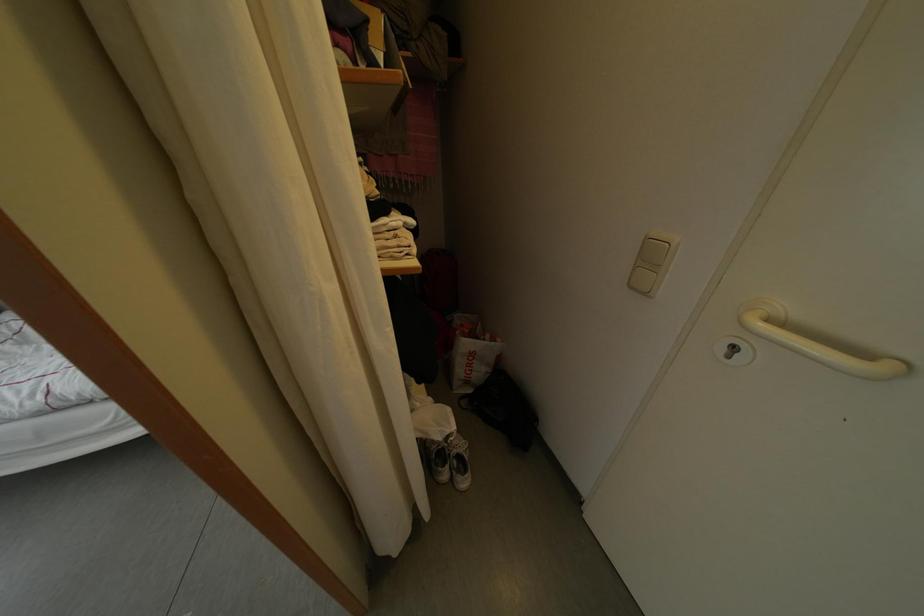
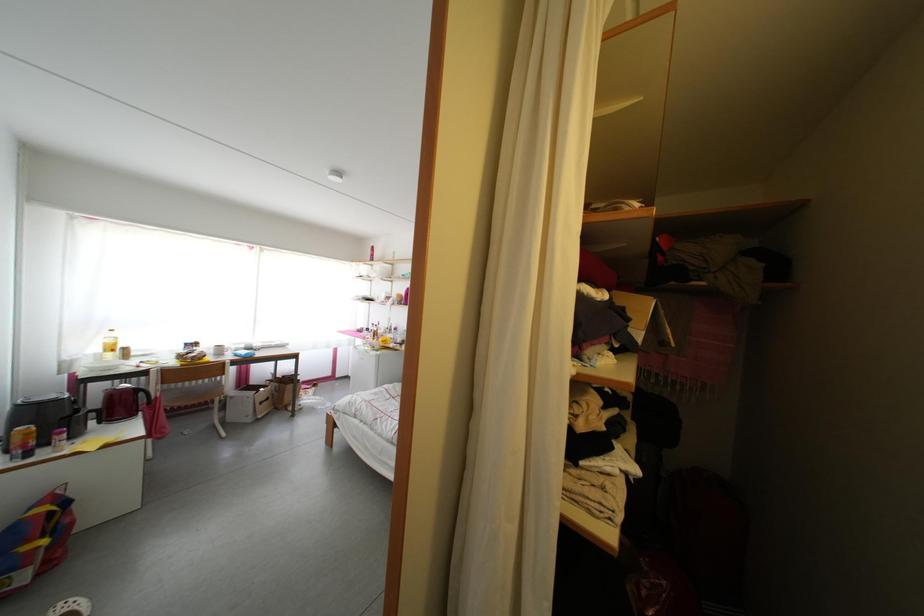
First-person continuous shooting, in which direction is the camera rotating?

The camera's rotation is toward left-up.